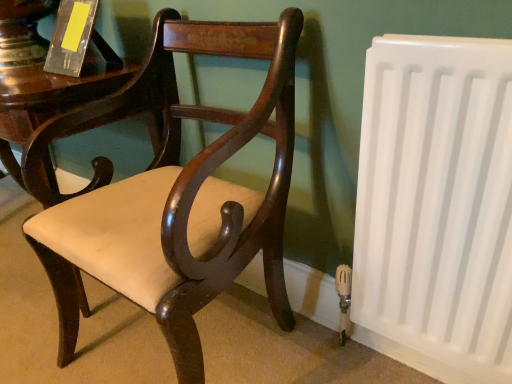
Locate an element on the screen. This screenshot has height=384, width=512. vacant space situated on the left part of white plastic radiator at right is located at coordinates (294, 354).